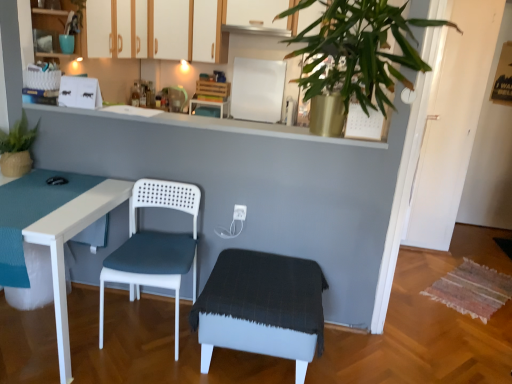
Question: Is matte green plant at left taller or shorter than matte blue cup at upper left, marked as the first cabinetry in a front-to-back arrangement?

Choices:
 (A) tall
 (B) short

Answer: (B)

Question: Is matte green plant at left wider or thinner than matte blue cup at upper left, positioned as the first cabinetry in left-to-right order?

Choices:
 (A) thin
 (B) wide

Answer: (A)

Question: Considering the real-world distances, which object is farthest from the white matte table at left?

Choices:
 (A) teal glossy cup at upper left
 (B) white matte cabinet at upper center, the first cabinetry in the right-to-left sequence
 (C) white plastic electric outlet at center
 (D) white plastic chair at center
 (E) white wood cabinets at upper center, which ranks as the second cabinetry in back-to-front order

Answer: (B)

Question: Which object is positioned closest to the white fabric step stool at center?

Choices:
 (A) white matte table at left
 (B) white plastic electric outlet at center
 (C) matte blue cup at upper left, marked as the 3th cabinetry in a back-to-front arrangement
 (D) white wood cabinets at upper center, which ranks as the second cabinetry in back-to-front order
 (E) teal glossy cup at upper left

Answer: (B)